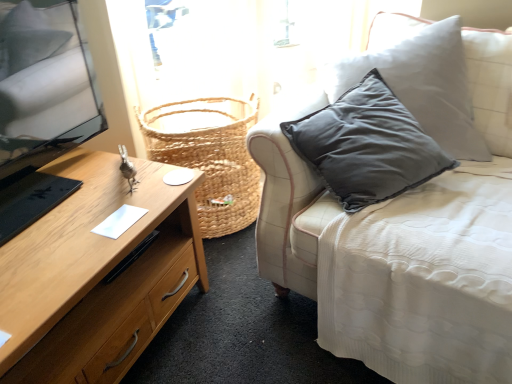
Question: From a real-world perspective, is woven natural basket at center located beneath wooden desk at left?

Choices:
 (A) yes
 (B) no

Answer: (B)

Question: Would you say woven natural basket at center is outside wooden desk at left?

Choices:
 (A) no
 (B) yes

Answer: (B)

Question: Is woven natural basket at center positioned with its back to wooden desk at left?

Choices:
 (A) no
 (B) yes

Answer: (A)

Question: From the image's perspective, is woven natural basket at center under wooden desk at left?

Choices:
 (A) yes
 (B) no

Answer: (B)

Question: Could wooden desk at left be considered to be inside woven natural basket at center?

Choices:
 (A) no
 (B) yes

Answer: (A)

Question: Considering the positions of woven natural basket at center and white fabric couch at center in the image, is woven natural basket at center taller or shorter than white fabric couch at center?

Choices:
 (A) tall
 (B) short

Answer: (B)

Question: In the image, is woven natural basket at center on the left side or the right side of white fabric couch at center?

Choices:
 (A) right
 (B) left

Answer: (B)

Question: From the image's perspective, is woven natural basket at center located above or below white fabric couch at center?

Choices:
 (A) above
 (B) below

Answer: (A)

Question: In the image, is woven natural basket at center positioned in front of or behind white fabric couch at center?

Choices:
 (A) behind
 (B) front

Answer: (A)

Question: In the image, is white fabric couch at center positioned in front of or behind woven natural basket at center?

Choices:
 (A) behind
 (B) front

Answer: (B)

Question: Is point (481, 119) positioned closer to the camera than point (203, 109)?

Choices:
 (A) closer
 (B) farther

Answer: (A)

Question: From a real-world perspective, relative to woven natural basket at center, is white fabric couch at center vertically above or below?

Choices:
 (A) below
 (B) above

Answer: (B)

Question: In the image, is white fabric couch at center on the left side or the right side of woven natural basket at center?

Choices:
 (A) right
 (B) left

Answer: (A)

Question: Considering the positions of white fabric couch at center and wooden desk at left in the image, is white fabric couch at center wider or thinner than wooden desk at left?

Choices:
 (A) thin
 (B) wide

Answer: (B)

Question: Considering their positions, is white fabric couch at center located in front of or behind wooden desk at left?

Choices:
 (A) behind
 (B) front

Answer: (B)